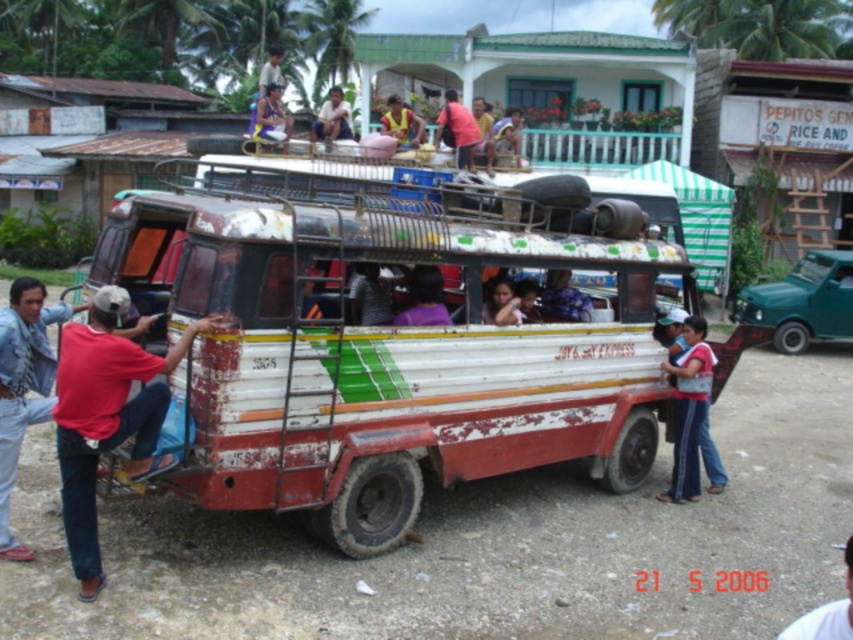
Question: Which of the following is the farthest from the observer?

Choices:
 (A) (445, 125)
 (B) (345, 138)

Answer: (B)

Question: Which of the following is the closest to the observer?

Choices:
 (A) purple fabric at center
 (B) purple fabric shirt at center
 (C) red matte shirt at left

Answer: (C)

Question: Based on their relative distances, which object is farther from the matte purple shirt at center?

Choices:
 (A) white fabric shirt at center
 (B) purple fabric at center
 (C) red matte shirt at left
 (D) matte pink shirt at upper center

Answer: (D)

Question: Is purple fabric at center positioned behind matte purple shirt at center?

Choices:
 (A) no
 (B) yes

Answer: (B)

Question: Can you confirm if red matte shirt at left is positioned to the right of matte pink shirt at upper center?

Choices:
 (A) no
 (B) yes

Answer: (A)

Question: Does rusty metal tour bus at center appear on the left side of purple fabric shirt at center?

Choices:
 (A) no
 (B) yes

Answer: (A)